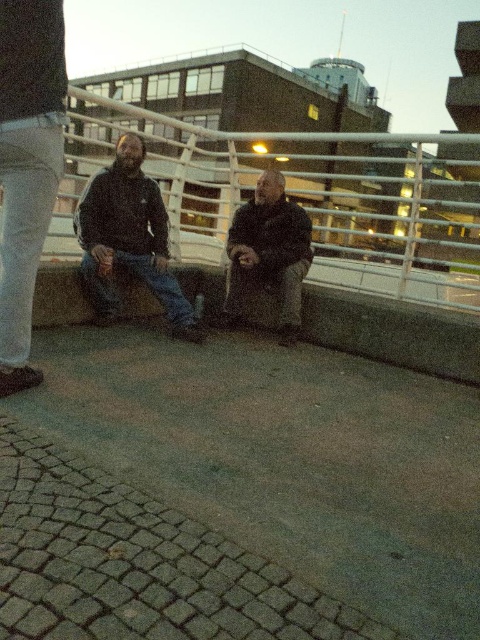
Who is positioned more to the right, white metal rail at center or dark blue denim jeans at center?

From the viewer's perspective, white metal rail at center appears more on the right side.

Is white metal rail at center positioned before dark blue denim jeans at center?

Yes, white metal rail at center is in front of dark blue denim jeans at center.

I want to click on white metal rail at center, so click(307, 195).

Can you confirm if dark gray sweater at center is smaller than dark brown leather jacket at center?

Incorrect, dark gray sweater at center is not smaller in size than dark brown leather jacket at center.

Who is taller, dark gray sweater at center or dark brown leather jacket at center?

dark gray sweater at center

The width and height of the screenshot is (480, 640). What do you see at coordinates (129, 237) in the screenshot?
I see `dark gray sweater at center` at bounding box center [129, 237].

The height and width of the screenshot is (640, 480). What are the coordinates of `dark gray sweater at center` in the screenshot? It's located at (129, 237).

Does point (106, 268) lie behind point (277, 316)?

No.

Who is shorter, dark gray sweater at center or dark blue denim jeans at center?

dark blue denim jeans at center

In order to click on dark gray sweater at center in this screenshot , I will do `click(129, 237)`.